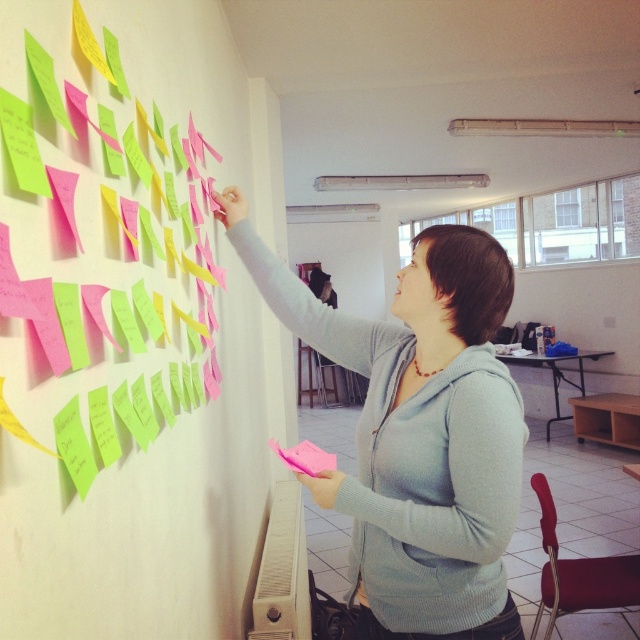
Question: Which of the following is the closest to the observer?

Choices:
 (A) (269, 250)
 (B) (24, 592)

Answer: (B)

Question: Which object appears farthest from the camera in this image?

Choices:
 (A) light blue sweater at upper center
 (B) pink paper notes at upper left

Answer: (A)

Question: Is pink paper notes at upper left positioned behind light blue sweater at upper center?

Choices:
 (A) no
 (B) yes

Answer: (A)

Question: Can you confirm if pink paper notes at upper left is positioned to the right of light blue sweater at upper center?

Choices:
 (A) yes
 (B) no

Answer: (B)

Question: Does pink paper notes at upper left appear on the left side of light blue sweater at upper center?

Choices:
 (A) yes
 (B) no

Answer: (A)